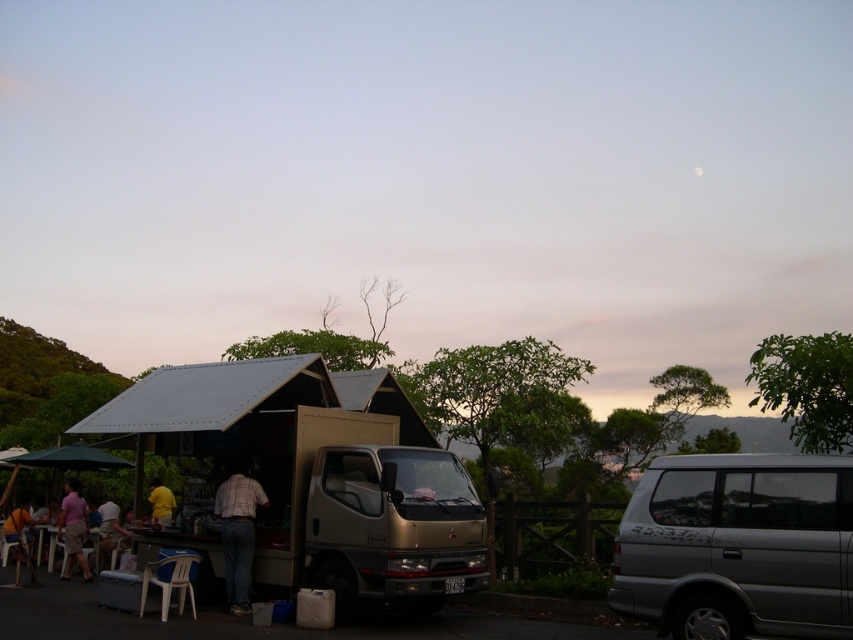
Between gold metallic van at center and light brown plastic chair at lower left, which one has less height?

light brown plastic chair at lower left is shorter.

Is gold metallic van at center to the right of light brown plastic chair at lower left from the viewer's perspective?

Correct, you'll find gold metallic van at center to the right of light brown plastic chair at lower left.

Between point (426, 509) and point (20, 518), which one is positioned behind?

Positioned behind is point (20, 518).

Where is `gold metallic van at center`? gold metallic van at center is located at coordinates coord(392,528).

Is plaid shirt at center shorter than white plastic table at lower left?

Incorrect, plaid shirt at center's height does not fall short of white plastic table at lower left's.

Does point (230, 545) come closer to viewer compared to point (45, 541)?

Yes, point (230, 545) is in front of point (45, 541).

This screenshot has width=853, height=640. Find the location of `plaid shirt at center`. plaid shirt at center is located at coordinates (236, 531).

Does pink fabric shirt at lower left have a lesser width compared to white plastic table at lower left?

No, pink fabric shirt at lower left is not thinner than white plastic table at lower left.

Between pink fabric shirt at lower left and white plastic table at lower left, which one appears on the right side from the viewer's perspective?

Positioned to the right is pink fabric shirt at lower left.

Who is more forward, (83, 502) or (48, 572)?

Point (83, 502)

Where is `pink fabric shirt at lower left`? pink fabric shirt at lower left is located at coordinates (73, 529).